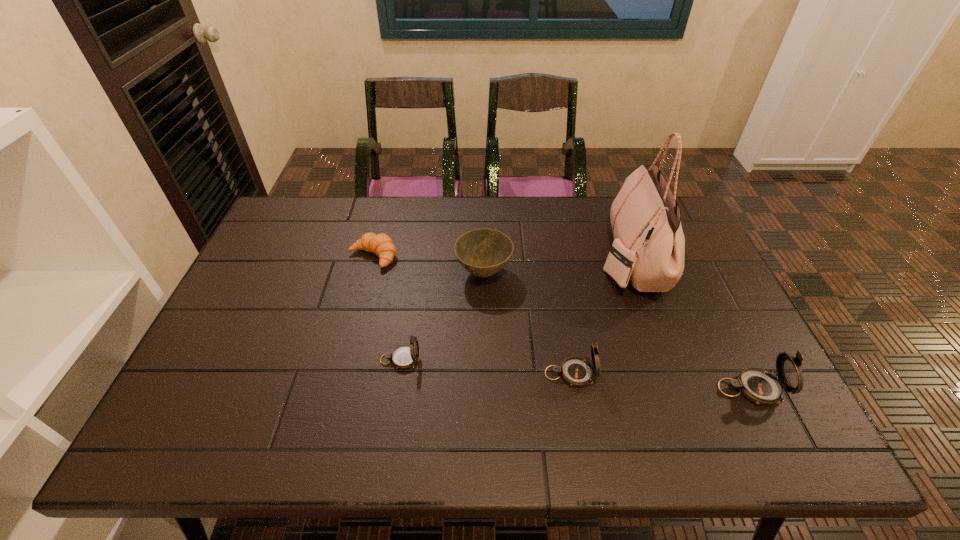
With all compasss evenly spaced, where should an extra compass be placed on the left to continue the pattern? Please point out a vacant space. Please provide its 2D coordinates. Your answer should be formatted as a tuple, i.e. [(x, y)], where the tuple contains the x and y coordinates of a point satisfying the conditions above.

[(239, 346)]